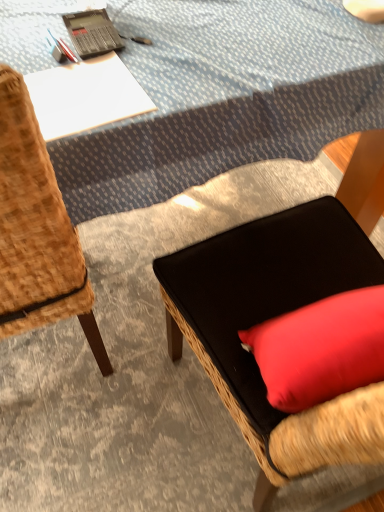
Question: Is woven wood chair at left, which is counted as the second chair, starting from the right, not close to blue textured tablecloth at upper center?

Choices:
 (A) yes
 (B) no

Answer: (B)

Question: Is the position of woven wood chair at left, which appears as the 1th chair when viewed from the left, more distant than that of blue textured tablecloth at upper center?

Choices:
 (A) yes
 (B) no

Answer: (B)

Question: Considering the relative sizes of woven wood chair at left, which appears as the 1th chair when viewed from the left, and blue textured tablecloth at upper center in the image provided, is woven wood chair at left, which appears as the 1th chair when viewed from the left, taller than blue textured tablecloth at upper center?

Choices:
 (A) yes
 (B) no

Answer: (A)

Question: Can you confirm if woven wood chair at left, which is counted as the second chair, starting from the right, is shorter than blue textured tablecloth at upper center?

Choices:
 (A) yes
 (B) no

Answer: (B)

Question: Is woven wood chair at left, which appears as the 1th chair when viewed from the left, not inside blue textured tablecloth at upper center?

Choices:
 (A) yes
 (B) no

Answer: (A)

Question: Relative to black fabric cushion at center, which is the second chair in left-to-right order, is black plastic calculator at upper left in front or behind?

Choices:
 (A) front
 (B) behind

Answer: (B)

Question: From the image's perspective, is black plastic calculator at upper left positioned above or below black fabric cushion at center, the 1th chair from the right?

Choices:
 (A) above
 (B) below

Answer: (A)

Question: Would you say black plastic calculator at upper left is inside or outside black fabric cushion at center, the 1th chair from the right?

Choices:
 (A) inside
 (B) outside

Answer: (B)

Question: Considering the positions of black plastic calculator at upper left and black fabric cushion at center, which is the second chair in left-to-right order, in the image, is black plastic calculator at upper left taller or shorter than black fabric cushion at center, which is the second chair in left-to-right order,?

Choices:
 (A) tall
 (B) short

Answer: (B)

Question: From the image's perspective, is woven wood chair at left, which appears as the 1th chair when viewed from the left, positioned above or below black plastic calculator at upper left?

Choices:
 (A) below
 (B) above

Answer: (A)

Question: Based on their sizes in the image, would you say woven wood chair at left, which is counted as the second chair, starting from the right, is bigger or smaller than black plastic calculator at upper left?

Choices:
 (A) big
 (B) small

Answer: (A)

Question: Is woven wood chair at left, which appears as the 1th chair when viewed from the left, taller or shorter than black plastic calculator at upper left?

Choices:
 (A) tall
 (B) short

Answer: (A)

Question: From a real-world perspective, is woven wood chair at left, which is counted as the second chair, starting from the right, positioned above or below black plastic calculator at upper left?

Choices:
 (A) above
 (B) below

Answer: (B)

Question: From a real-world perspective, is blue textured tablecloth at upper center above or below black plastic calculator at upper left?

Choices:
 (A) above
 (B) below

Answer: (B)

Question: Based on their sizes in the image, would you say blue textured tablecloth at upper center is bigger or smaller than black plastic calculator at upper left?

Choices:
 (A) small
 (B) big

Answer: (B)